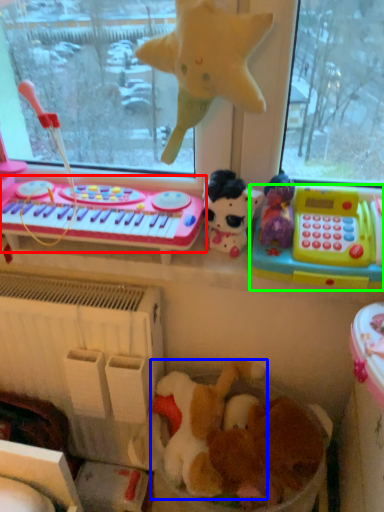
Question: Which object is positioned farthest from musical keyboard (highlighted by a red box)? Select from toy (highlighted by a blue box) and toy (highlighted by a green box).

Choices:
 (A) toy
 (B) toy

Answer: (A)